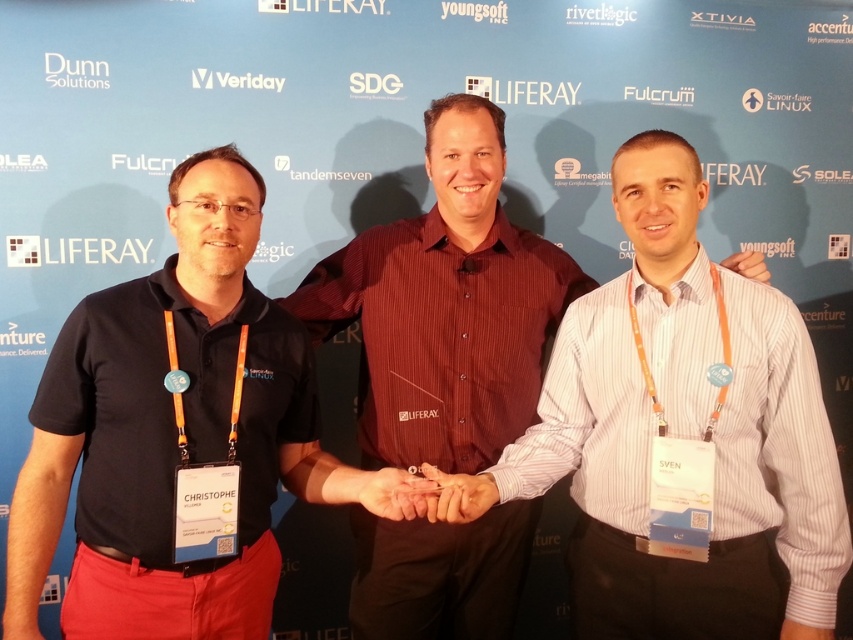
Who is positioned more to the right, black shirt at center or matte red shirt at center?

matte red shirt at center is more to the right.

Who is positioned more to the left, black shirt at center or matte red shirt at center?

From the viewer's perspective, black shirt at center appears more on the left side.

You are a GUI agent. You are given a task and a screenshot of the screen. Output one action in this format:
    pyautogui.click(x=<x>, y=<y>)
    Task: Click on the black shirt at center
    
    Given the screenshot: What is the action you would take?
    pyautogui.click(x=172, y=433)